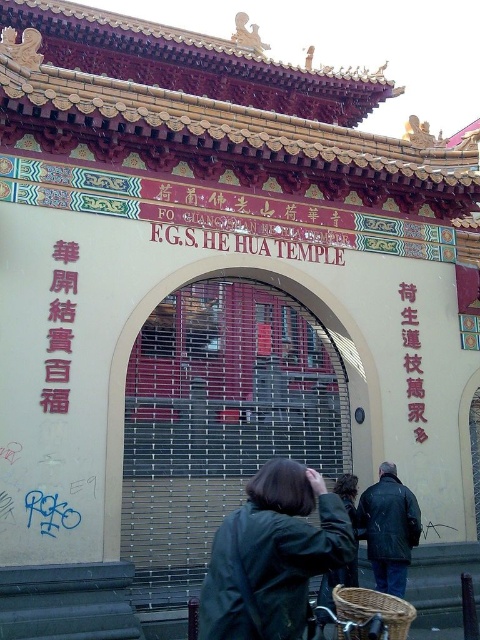
You are a visitor arriving at the F.G.S. He Hua Temple. You see the metallic gate at center and the pink paper text at center right. Which object is bigger in size?

The metallic gate at center has a larger size compared to the pink paper text at center right.

You are a visitor at the F.G.S. He Hua Temple entrance and notice a leather jacket at center and a black matte bicycle at lower center. Which object takes up more space in the scene?

The leather jacket at center is bigger than the black matte bicycle at lower center, so it takes up more space in the scene.